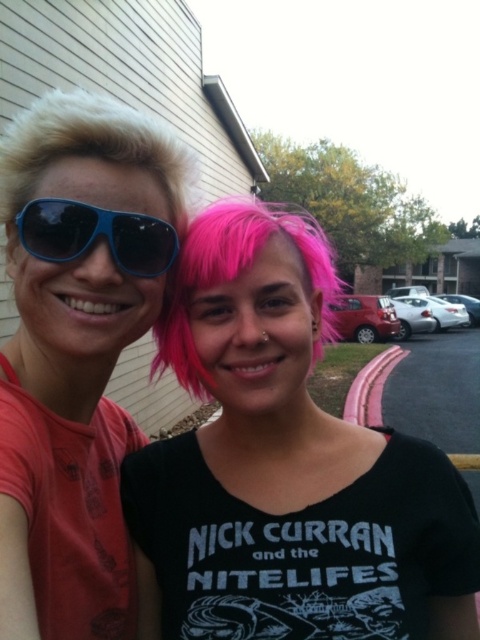
You are a photographer trying to capture the perfect selfie. You have two subjects, the blondehair at left and the pinkhair at right. Based on their positions, which subject is closer to the left edge of the frame?

The blondehair at left is closer to the left edge of the frame because their 2D location is at point (92, 148), which places them closer to the left side compared to the pinkhair at right.

You are a photographer trying to capture the best selfie shot. The two subjects are the pink matte hair at center and the blondehair at left. Based on their positions, which subject should you move to the left to frame them better?

The blondehair at left should be moved to the left since the pink matte hair at center is already positioned to its right, creating an imbalance. Moving the blondehair at left further left could help balance the composition.

You are a photographer trying to capture a clear photo of both the pink matte hair at center and the blue matte sunglasses at left. Considering their sizes, which object should you focus on first to ensure both are in frame?

The pink matte hair at center might be wider than blue matte sunglasses at left, so you should focus on the pink matte hair at center first to ensure both fit in the frame.